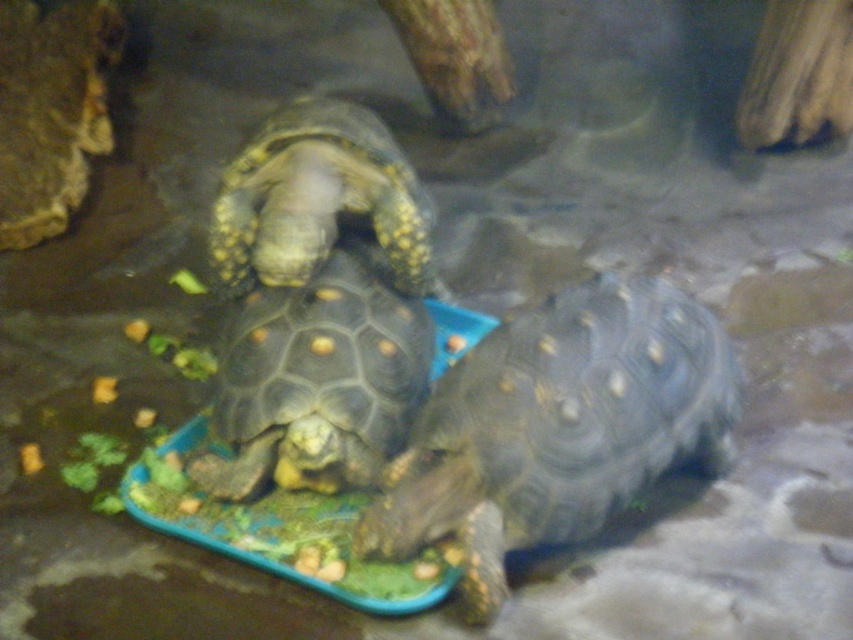
Is the position of dark gray textured shell at center less distant than that of yellowish matte tortoise at center?

Yes, it is.

Can you confirm if dark gray textured shell at center is positioned to the left of yellowish matte tortoise at center?

No, dark gray textured shell at center is not to the left of yellowish matte tortoise at center.

Is point (473, 488) less distant than point (247, 400)?

Yes, it is in front of point (247, 400).

This screenshot has height=640, width=853. What are the coordinates of `dark gray textured shell at center` in the screenshot? It's located at click(x=556, y=428).

Between dark gray textured shell at center and yellowish-brown scaly shell at center, which one appears on the left side from the viewer's perspective?

From the viewer's perspective, yellowish-brown scaly shell at center appears more on the left side.

Which is below, dark gray textured shell at center or yellowish-brown scaly shell at center?

dark gray textured shell at center is below.

Where is `dark gray textured shell at center`? dark gray textured shell at center is located at coordinates (x=556, y=428).

Is yellowish matte tortoise at center closer to the viewer compared to yellowish-brown scaly shell at center?

That is True.

Is point (366, 465) positioned in front of point (247, 184)?

That is True.

You are a GUI agent. You are given a task and a screenshot of the screen. Output one action in this format:
    pyautogui.click(x=<x>, y=<y>)
    Task: Click on the yellowish matte tortoise at center
    The image size is (853, 640).
    Given the screenshot: What is the action you would take?
    pyautogui.click(x=315, y=381)